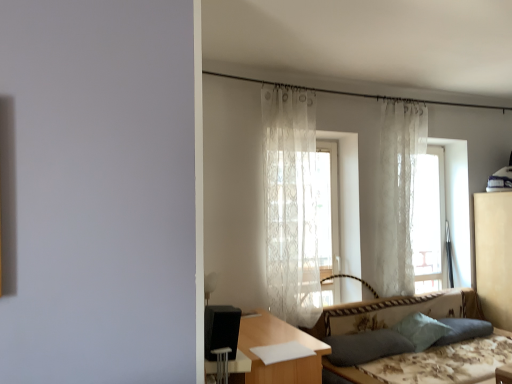
Question: Is dark fabric pillow at lower right, marked as the first pillow in a left-to-right arrangement, at the back of beige fabric dresser at right?

Choices:
 (A) yes
 (B) no

Answer: (B)

Question: Can you confirm if beige fabric dresser at right is positioned to the right of dark fabric pillow at lower right, marked as the first pillow in a left-to-right arrangement?

Choices:
 (A) no
 (B) yes

Answer: (B)

Question: Can you confirm if beige fabric dresser at right is bigger than dark fabric pillow at lower right, marked as the first pillow in a left-to-right arrangement?

Choices:
 (A) no
 (B) yes

Answer: (B)

Question: Can you confirm if beige fabric dresser at right is shorter than dark fabric pillow at lower right, placed as the 3th pillow when sorted from right to left?

Choices:
 (A) yes
 (B) no

Answer: (B)

Question: From a real-world perspective, is beige fabric dresser at right physically above dark fabric pillow at lower right, marked as the first pillow in a left-to-right arrangement?

Choices:
 (A) yes
 (B) no

Answer: (A)

Question: From a real-world perspective, is beige fabric dresser at right positioned under dark fabric pillow at lower right, marked as the first pillow in a left-to-right arrangement, based on gravity?

Choices:
 (A) no
 (B) yes

Answer: (A)

Question: Is transparent lace curtain at upper right at the back of white lace curtain at right, acting as the 2th curtain starting from the left?

Choices:
 (A) no
 (B) yes

Answer: (A)

Question: Is white lace curtain at right, which ranks as the 1th curtain in back-to-front order, positioned behind transparent lace curtain at upper right?

Choices:
 (A) no
 (B) yes

Answer: (A)

Question: Can you see white lace curtain at right, acting as the 2th curtain starting from the left, touching transparent lace curtain at upper right?

Choices:
 (A) no
 (B) yes

Answer: (A)

Question: Is white lace curtain at right, positioned as the second curtain in front-to-back order, far from transparent lace curtain at upper right?

Choices:
 (A) no
 (B) yes

Answer: (A)

Question: Is white lace curtain at right, positioned as the second curtain in front-to-back order, at the left side of transparent lace curtain at upper right?

Choices:
 (A) no
 (B) yes

Answer: (B)

Question: Is white lace curtain at right, positioned as the second curtain in front-to-back order, at the right side of transparent lace curtain at upper right?

Choices:
 (A) no
 (B) yes

Answer: (A)

Question: Is beige fabric dresser at right outside translucent white curtain at center?

Choices:
 (A) no
 (B) yes

Answer: (B)